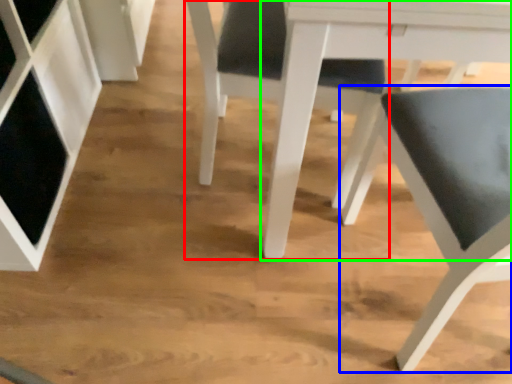
Question: Based on their relative distances, which object is farther from chair (highlighted by a red box)? Choose from chair (highlighted by a blue box) and table (highlighted by a green box).

Choices:
 (A) chair
 (B) table

Answer: (A)